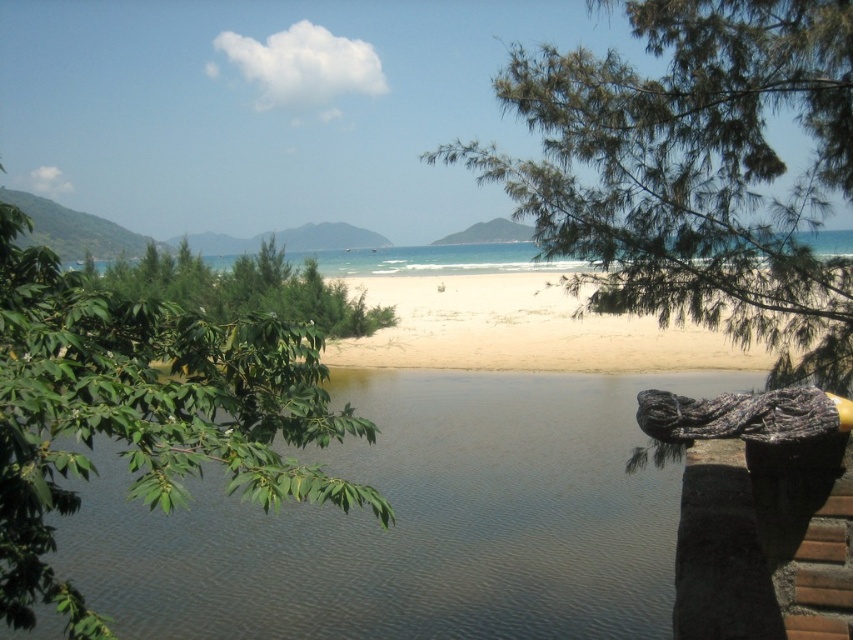
Is green leafy tree at left to the left of green leafy tree at center from the viewer's perspective?

No, green leafy tree at left is not to the left of green leafy tree at center.

From the picture: Who is positioned more to the right, green leafy tree at left or green leafy tree at center?

From the viewer's perspective, green leafy tree at left appears more on the right side.

I want to click on green leafy tree at left, so click(142, 412).

From the picture: Does green needle-like leaves at center appear over white sandy beach at center?

No.

In the scene shown: Is green needle-like leaves at center positioned behind white sandy beach at center?

No, it is not.

Between point (761, 83) and point (502, 305), which one is positioned behind?

Point (502, 305)

At what (x,y) coordinates should I click in order to perform the action: click on green needle-like leaves at center. Please return your answer as a coordinate pair (x, y). Looking at the image, I should click on (694, 172).

Based on the photo, who is more distant from viewer, (548, 314) or (283, 262)?

The point (283, 262) is more distant.

What do you see at coordinates (521, 330) in the screenshot? Image resolution: width=853 pixels, height=640 pixels. I see `white sandy beach at center` at bounding box center [521, 330].

Image resolution: width=853 pixels, height=640 pixels. In order to click on white sandy beach at center in this screenshot , I will do `click(521, 330)`.